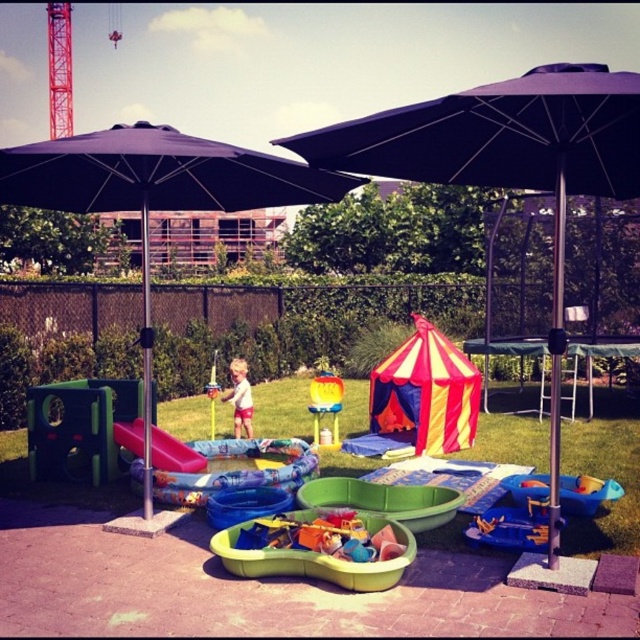
Question: Can you confirm if striped fabric tent at center is positioned to the left of metallic silver toy at center?

Choices:
 (A) no
 (B) yes

Answer: (A)

Question: In this image, where is green plastic sandbox at center located relative to red painted metal tower at upper left?

Choices:
 (A) right
 (B) left

Answer: (A)

Question: Is the position of black fabric umbrella at left more distant than that of red painted metal tower at upper left?

Choices:
 (A) yes
 (B) no

Answer: (B)

Question: Which point appears farthest from the camera in this image?

Choices:
 (A) (324, 564)
 (B) (211, 412)

Answer: (B)

Question: Which is nearer to the orange plastic bucket at center?

Choices:
 (A) blue plastic bucket at lower right
 (B) rubberized pink slide at left

Answer: (A)

Question: Which of these objects is positioned farthest from the black fabric umbrella at left?

Choices:
 (A) black fabric umbrella at upper center
 (B) light blue shorts at center
 (C) green plastic sandbox at center

Answer: (B)